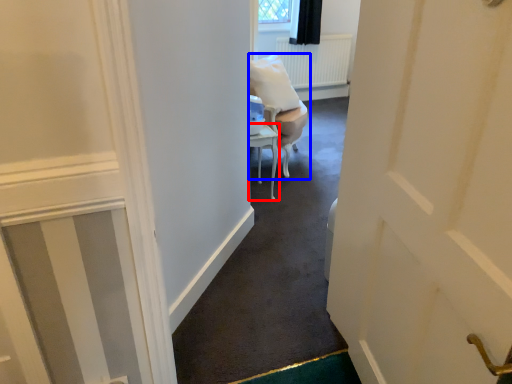
Question: Which object is further to the camera taking this photo, furniture (highlighted by a red box) or chair (highlighted by a blue box)?

Choices:
 (A) furniture
 (B) chair

Answer: (B)